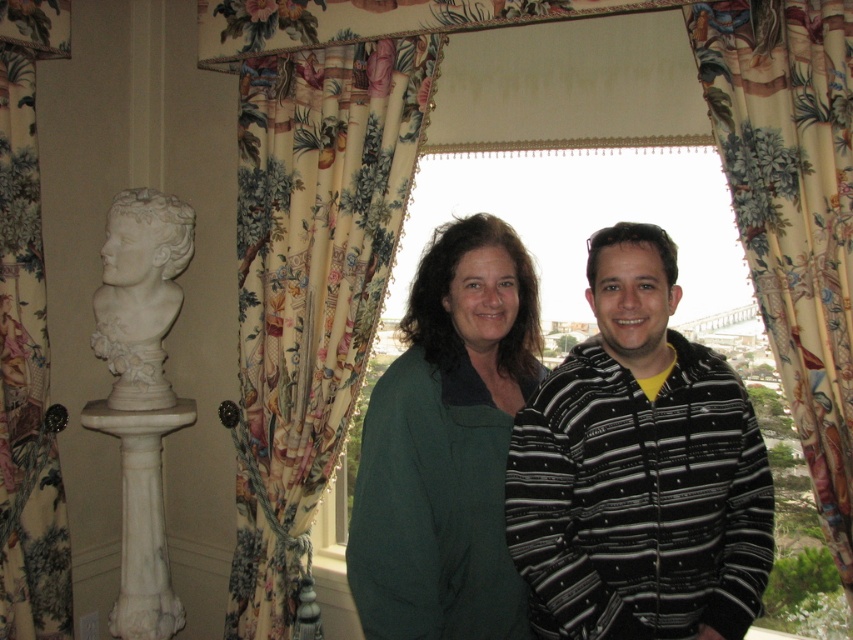
Question: Estimate the real-world distances between objects in this image. Which object is farther from the floral fabric curtain at center?

Choices:
 (A) green woolen sweater at center
 (B) floral fabric curtain at right
 (C) dark green sweater at center
 (D) floral fabric curtain at left

Answer: (B)

Question: Among these points, which one is farthest from the camera?

Choices:
 (A) (62, 620)
 (B) (804, 436)
 (C) (479, 392)

Answer: (A)

Question: Does dark green sweater at center have a lesser width compared to floral fabric curtain at right?

Choices:
 (A) yes
 (B) no

Answer: (B)

Question: Which object appears farthest from the camera in this image?

Choices:
 (A) floral fabric curtain at right
 (B) floral fabric curtain at center
 (C) dark green sweater at center

Answer: (B)

Question: Is floral fabric curtain at left bigger than white marble bust at left?

Choices:
 (A) yes
 (B) no

Answer: (A)

Question: Is floral fabric curtain at right thinner than white marble bust at left?

Choices:
 (A) yes
 (B) no

Answer: (B)